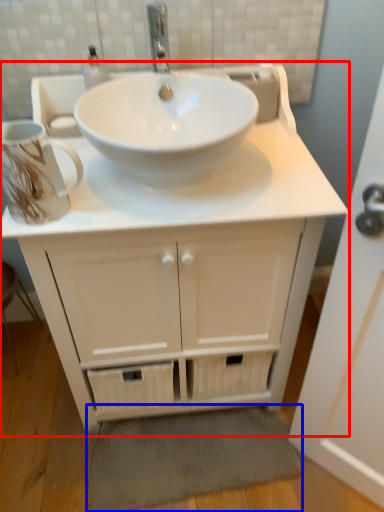
Question: Which object appears farthest to the camera in this image, bathroom cabinet (highlighted by a red box) or bath mat (highlighted by a blue box)?

Choices:
 (A) bathroom cabinet
 (B) bath mat

Answer: (B)